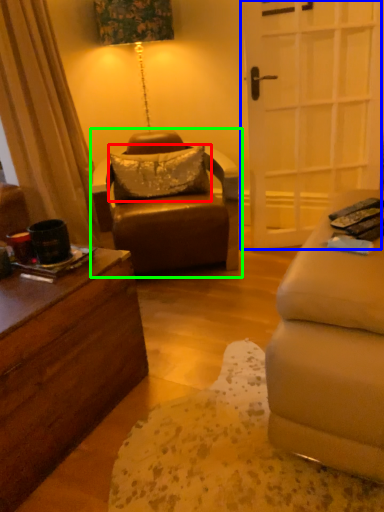
Question: Which object is the closest to the pillow (highlighted by a red box)? Choose among these: door (highlighted by a blue box) or chair (highlighted by a green box).

Choices:
 (A) door
 (B) chair

Answer: (B)